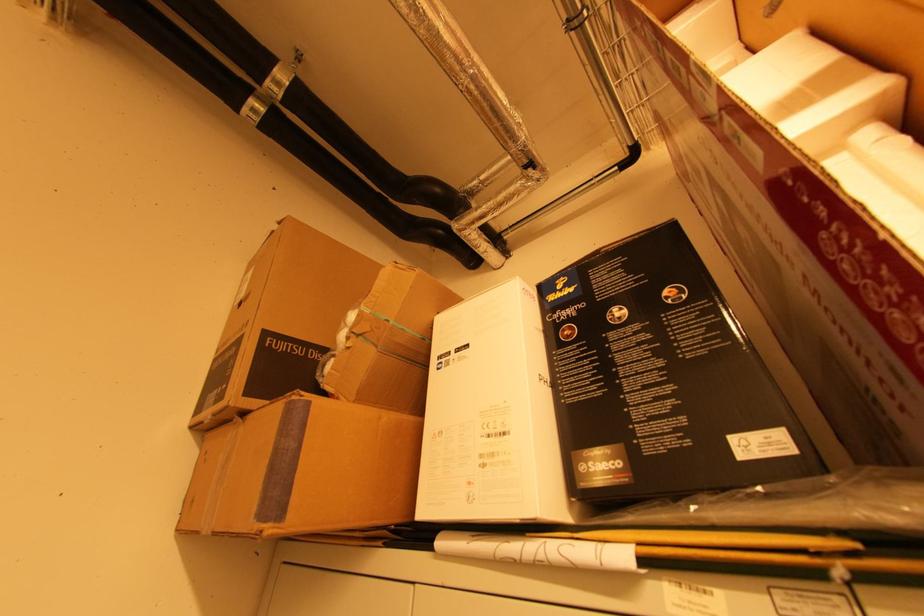
Where would you lift the brown cardboard box? Please return your answer as a coordinate pair (x, y).

(304, 471)